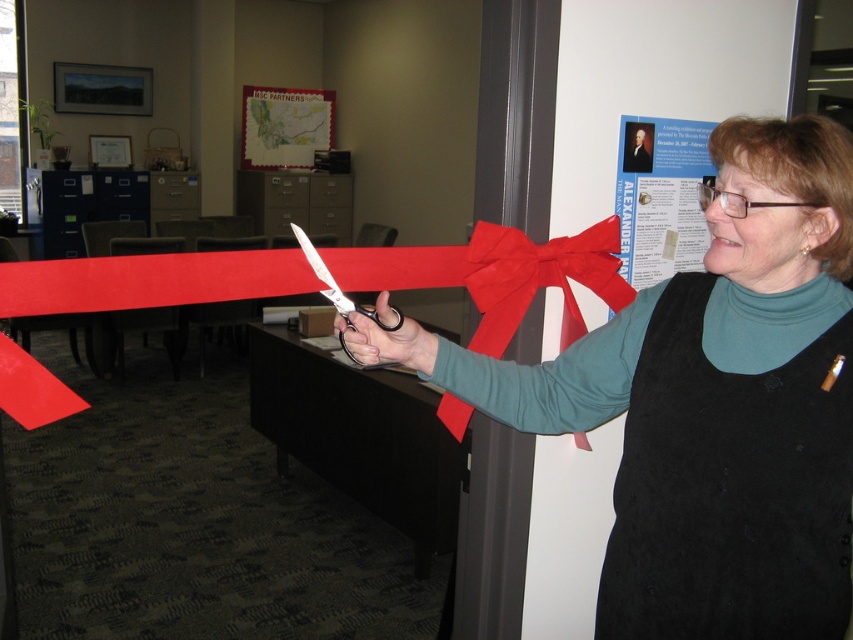
Can you confirm if matte black vest at center is positioned to the left of red satin ribbon at center?

Yes, matte black vest at center is to the left of red satin ribbon at center.

Between point (610, 385) and point (567, 330), which one is positioned in front?

Point (610, 385)

Between point (703, 600) and point (561, 320), which one is positioned in front?

Positioned in front is point (703, 600).

What are the coordinates of `matte black vest at center` in the screenshot? It's located at 701,403.

Does matte black vest at center appear under red paper ribbon at center?

Correct, matte black vest at center is located below red paper ribbon at center.

Can you confirm if matte black vest at center is thinner than red paper ribbon at center?

Correct, matte black vest at center's width is less than red paper ribbon at center's.

Is point (453, 360) closer to viewer compared to point (167, 266)?

Yes, it is in front of point (167, 266).

Where is `matte black vest at center`? matte black vest at center is located at coordinates pyautogui.click(x=701, y=403).

Between red paper ribbon at center and red satin ribbon at center, which one is positioned higher?

red satin ribbon at center

Which of these two, red paper ribbon at center or red satin ribbon at center, stands shorter?

With less height is red paper ribbon at center.

Where is `red paper ribbon at center`? red paper ribbon at center is located at coordinates (340, 276).

Where is `red paper ribbon at center`? This screenshot has width=853, height=640. red paper ribbon at center is located at coordinates (340, 276).